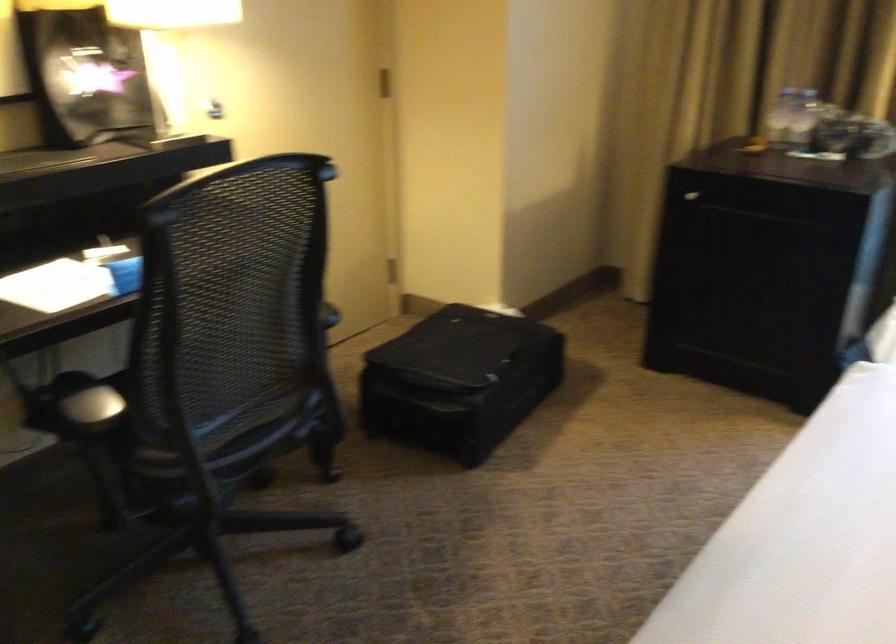
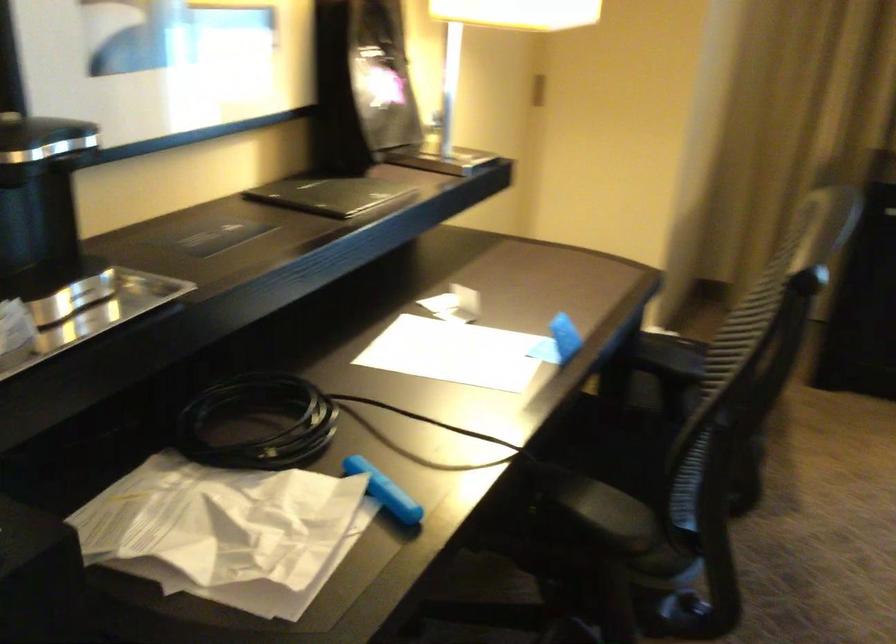
In the second image, find the point that corresponds to pixel 208 506 in the first image.

(679, 614)